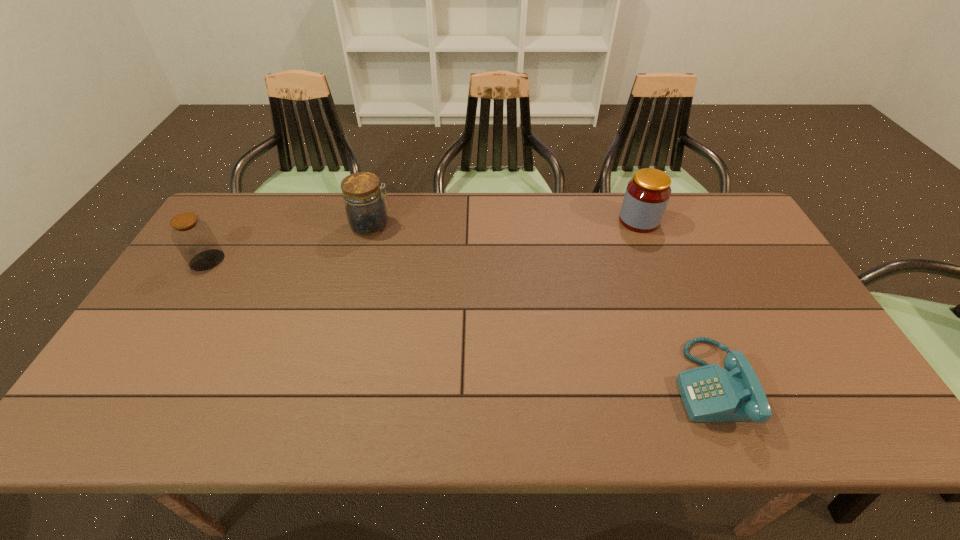
The width and height of the screenshot is (960, 540). Identify the location of the third object from right to left. (365, 207).

The image size is (960, 540). Identify the location of the rightmost jar. (647, 194).

The height and width of the screenshot is (540, 960). In order to click on the leftmost object in this screenshot , I will do `click(194, 239)`.

The image size is (960, 540). In order to click on the nearest jar in this screenshot , I will do `click(194, 239)`.

Where is `the shortest object`? Image resolution: width=960 pixels, height=540 pixels. the shortest object is located at coordinates (710, 393).

This screenshot has width=960, height=540. In order to click on the nearest object in this screenshot , I will do `click(710, 393)`.

Identify the location of vacant space located on the lid of the third object from right to left. The image size is (960, 540). (492, 225).

Identify the location of vacant space situated on the right of the rightmost jar. (695, 221).

Where is `vacant space located on the front of the leftmost object`? This screenshot has height=540, width=960. vacant space located on the front of the leftmost object is located at coordinates (191, 287).

You are a GUI agent. You are given a task and a screenshot of the screen. Output one action in this format:
    pyautogui.click(x=<x>, y=<y>)
    Task: Click on the vacant space located on the dial of the telephone
    
    Given the screenshot: What is the action you would take?
    pyautogui.click(x=556, y=383)